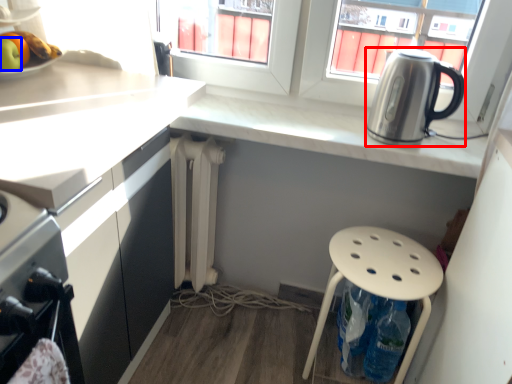
Question: Which point is closer to the camera, kitchen appliance (highlighted by a red box) or apple (highlighted by a blue box)?

Choices:
 (A) kitchen appliance
 (B) apple

Answer: (B)